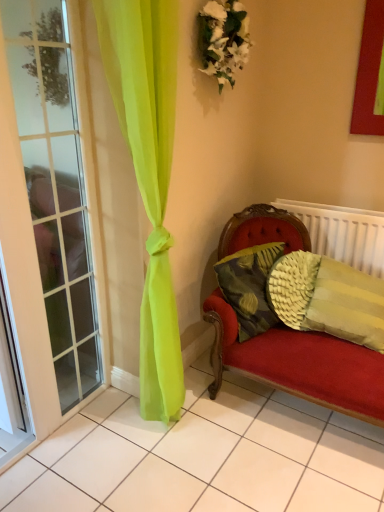
Question: Considering the relative sizes of clear glass door at left and textured yellow pillow at right, which ranks as the 2th pillow in left-to-right order, in the image provided, is clear glass door at left smaller than textured yellow pillow at right, which ranks as the 2th pillow in left-to-right order,?

Choices:
 (A) no
 (B) yes

Answer: (A)

Question: Is clear glass door at left positioned behind textured yellow pillow at right, which ranks as the 2th pillow in left-to-right order?

Choices:
 (A) yes
 (B) no

Answer: (B)

Question: Is clear glass door at left closer to camera compared to textured yellow pillow at right, positioned as the first pillow in right-to-left order?

Choices:
 (A) yes
 (B) no

Answer: (A)

Question: Is clear glass door at left oriented away from textured yellow pillow at right, which ranks as the 2th pillow in left-to-right order?

Choices:
 (A) yes
 (B) no

Answer: (B)

Question: Is clear glass door at left far from textured yellow pillow at right, which ranks as the 2th pillow in left-to-right order?

Choices:
 (A) no
 (B) yes

Answer: (B)

Question: Considering the relative positions of textured yellow pillow at right, which is the second pillow from right to left, and textured yellow pillow at right, which ranks as the 2th pillow in left-to-right order, in the image provided, is textured yellow pillow at right, which is the second pillow from right to left, to the left or to the right of textured yellow pillow at right, which ranks as the 2th pillow in left-to-right order,?

Choices:
 (A) right
 (B) left

Answer: (B)

Question: Is textured yellow pillow at right, which is the second pillow from right to left, in front of or behind textured yellow pillow at right, positioned as the first pillow in right-to-left order, in the image?

Choices:
 (A) behind
 (B) front

Answer: (A)

Question: Looking at their shapes, would you say textured yellow pillow at right, which is the second pillow from right to left, is wider or thinner than textured yellow pillow at right, which ranks as the 2th pillow in left-to-right order?

Choices:
 (A) thin
 (B) wide

Answer: (A)

Question: In terms of height, does textured yellow pillow at right, which is the second pillow from right to left, look taller or shorter compared to textured yellow pillow at right, positioned as the first pillow in right-to-left order?

Choices:
 (A) short
 (B) tall

Answer: (A)

Question: Is white textured radiator at right bigger or smaller than textured yellow pillow at right, which ranks as the 2th pillow in left-to-right order?

Choices:
 (A) big
 (B) small

Answer: (B)

Question: Considering the relative positions of white textured radiator at right and textured yellow pillow at right, which ranks as the 2th pillow in left-to-right order, in the image provided, is white textured radiator at right to the left or to the right of textured yellow pillow at right, which ranks as the 2th pillow in left-to-right order,?

Choices:
 (A) left
 (B) right

Answer: (B)

Question: Relative to textured yellow pillow at right, positioned as the first pillow in right-to-left order, is white textured radiator at right in front or behind?

Choices:
 (A) front
 (B) behind

Answer: (B)

Question: From the image's perspective, relative to textured yellow pillow at right, which ranks as the 2th pillow in left-to-right order, is white textured radiator at right above or below?

Choices:
 (A) below
 (B) above

Answer: (B)

Question: Would you say textured yellow pillow at right, which ranks as the 2th pillow in left-to-right order, is to the left or to the right of clear glass door at left in the picture?

Choices:
 (A) right
 (B) left

Answer: (A)

Question: Does point (268, 288) appear closer or farther from the camera than point (23, 31)?

Choices:
 (A) closer
 (B) farther

Answer: (A)